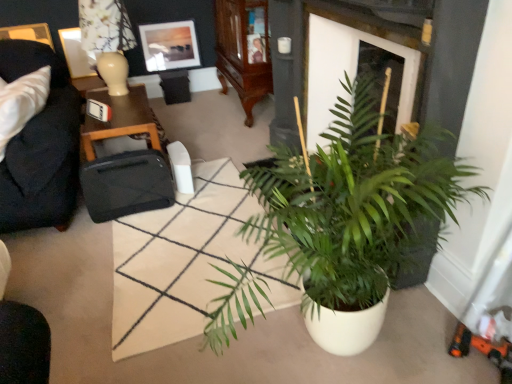
This screenshot has width=512, height=384. What do you see at coordinates (120, 119) in the screenshot?
I see `black leather suitcase at left` at bounding box center [120, 119].

The image size is (512, 384). What are the coordinates of `black matte suitcase at center` in the screenshot? It's located at (126, 184).

What is the approximate height of dark blue fabric couch at left?

The height of dark blue fabric couch at left is 71.08 centimeters.

Describe the element at coordinates (169, 45) in the screenshot. The height and width of the screenshot is (384, 512). I see `matte glass picture frame at upper center, marked as the first picture frame in a right-to-left arrangement` at that location.

This screenshot has height=384, width=512. In order to click on black leather suitcase at left in this screenshot , I will do `click(120, 119)`.

Based on the photo, from a real-world perspective, is dark blue fabric couch at left beneath black leather suitcase at left?

No, from a real-world perspective, dark blue fabric couch at left is not under black leather suitcase at left.

Considering the sizes of objects dark blue fabric couch at left and black leather suitcase at left in the image provided, who is bigger, dark blue fabric couch at left or black leather suitcase at left?

With larger size is dark blue fabric couch at left.

Between dark blue fabric couch at left and black leather suitcase at left, which one is positioned behind?

black leather suitcase at left is more distant.

Is dark blue fabric couch at left turned away from black leather suitcase at left?

No, dark blue fabric couch at left's orientation is not away from black leather suitcase at left.

Measure the distance from white glossy picture frame at upper left, the 1th picture frame in the left-to-right sequence, to wooden cabinet at upper center.

1.37 meters.

Would you consider white glossy picture frame at upper left, which ranks as the second picture frame in right-to-left order, to be distant from wooden cabinet at upper center?

Absolutely, white glossy picture frame at upper left, which ranks as the second picture frame in right-to-left order, is distant from wooden cabinet at upper center.

Does white glossy picture frame at upper left, the 1th picture frame in the left-to-right sequence, turn towards wooden cabinet at upper center?

No, white glossy picture frame at upper left, the 1th picture frame in the left-to-right sequence, is not facing towards wooden cabinet at upper center.

From the image's perspective, starting from the wooden cabinet at upper center, which picture frame is the 1st one above? Please provide its 2D coordinates.

[(76, 53)]

Which is correct: black leather suitcase at left is inside matte glass picture frame at upper center, marked as the first picture frame in a right-to-left arrangement, or outside of it?

black leather suitcase at left is not enclosed by matte glass picture frame at upper center, marked as the first picture frame in a right-to-left arrangement.

Can you confirm if black leather suitcase at left is thinner than matte glass picture frame at upper center, marked as the first picture frame in a right-to-left arrangement?

Incorrect, the width of black leather suitcase at left is not less than that of matte glass picture frame at upper center, marked as the first picture frame in a right-to-left arrangement.

From the image's perspective, which is above, black leather suitcase at left or matte glass picture frame at upper center, the second picture frame in the left-to-right sequence?

matte glass picture frame at upper center, the second picture frame in the left-to-right sequence.

This screenshot has height=384, width=512. Find the location of `desk lying in front of the matte glass picture frame at upper center, the second picture frame in the left-to-right sequence`. desk lying in front of the matte glass picture frame at upper center, the second picture frame in the left-to-right sequence is located at coordinates (120, 119).

Can you confirm if green leafy plant at center is taller than black matte suitcase at center?

No, green leafy plant at center is not taller than black matte suitcase at center.

Would you say green leafy plant at center is outside black matte suitcase at center?

green leafy plant at center is positioned outside black matte suitcase at center.

Considering their positions, is green leafy plant at center located in front of or behind black matte suitcase at center?

Clearly, green leafy plant at center is in front of black matte suitcase at center.

How much distance is there between green leafy plant at center and black matte suitcase at center?

14.10 inches.

Which object is wider, black matte suitcase at center or white ceramic lamp at upper left?

white ceramic lamp at upper left.

Could white ceramic lamp at upper left be considered to be inside black matte suitcase at center?

That's incorrect, white ceramic lamp at upper left is not inside black matte suitcase at center.

Looking at this image, considering the sizes of objects black matte suitcase at center and white ceramic lamp at upper left in the image provided, who is bigger, black matte suitcase at center or white ceramic lamp at upper left?

With larger size is white ceramic lamp at upper left.

Based on the photo, from a real-world perspective, which object rests below the other?

From a 3D spatial view, black matte suitcase at center is below.

Consider the image. From a real-world perspective, which is physically above, green matte plant at center or green leafy plant at center?

green matte plant at center, from a real-world perspective.

Can you tell me how much green matte plant at center and green leafy plant at center differ in facing direction?

green matte plant at center and green leafy plant at center are facing 2.18 degrees away from each other.

Identify the location of houseplant above the green leafy plant at center (from a real-world perspective). This screenshot has height=384, width=512. (352, 204).

Between green matte plant at center and green leafy plant at center, which one appears on the right side from the viewer's perspective?

From the viewer's perspective, green matte plant at center appears more on the right side.

Considering the sizes of matte glass picture frame at upper center, the second picture frame in the left-to-right sequence, and black leather suitcase at left in the image, is matte glass picture frame at upper center, the second picture frame in the left-to-right sequence, taller or shorter than black leather suitcase at left?

Clearly, matte glass picture frame at upper center, the second picture frame in the left-to-right sequence, is taller compared to black leather suitcase at left.

Considering the sizes of matte glass picture frame at upper center, the second picture frame in the left-to-right sequence, and black leather suitcase at left in the image, is matte glass picture frame at upper center, the second picture frame in the left-to-right sequence, bigger or smaller than black leather suitcase at left?

In the image, matte glass picture frame at upper center, the second picture frame in the left-to-right sequence, appears to be smaller than black leather suitcase at left.

From the image's perspective, would you say matte glass picture frame at upper center, marked as the first picture frame in a right-to-left arrangement, is positioned over black leather suitcase at left?

Yes, from the image's perspective, matte glass picture frame at upper center, marked as the first picture frame in a right-to-left arrangement, is above black leather suitcase at left.

Can you tell me how much matte glass picture frame at upper center, marked as the first picture frame in a right-to-left arrangement, and black leather suitcase at left differ in facing direction?

The angle between the facing direction of matte glass picture frame at upper center, marked as the first picture frame in a right-to-left arrangement, and the facing direction of black leather suitcase at left is 90.1 degrees.

Find the location of a particular element. desk beneath the dark blue fabric couch at left (from a real-world perspective) is located at coordinates (120, 119).

Locate an element on the screen. The width and height of the screenshot is (512, 384). the 1st picture frame behind the wooden cabinet at upper center is located at coordinates (76, 53).

Which object lies nearer to the anchor point green leafy plant at center, white glossy picture frame at upper left, the 1th picture frame in the left-to-right sequence, or wooden cabinet at upper center?

wooden cabinet at upper center is positioned closer to the anchor green leafy plant at center.

Looking at the image, which one is located closer to white ceramic lamp at upper left, black matte suitcase at center or dark blue fabric couch at left?

dark blue fabric couch at left is closer to white ceramic lamp at upper left.

Based on their spatial positions, is matte glass picture frame at upper center, marked as the first picture frame in a right-to-left arrangement, or wooden cabinet at upper center closer to white glossy picture frame at upper left, the 1th picture frame in the left-to-right sequence?

Based on the image, matte glass picture frame at upper center, marked as the first picture frame in a right-to-left arrangement, appears to be nearer to white glossy picture frame at upper left, the 1th picture frame in the left-to-right sequence.

Which object lies nearer to the anchor point green matte plant at center, dark blue fabric couch at left or black matte suitcase at center?

black matte suitcase at center is positioned closer to the anchor green matte plant at center.

Estimate the real-world distances between objects in this image. Which object is further from white glossy picture frame at upper left, which ranks as the second picture frame in right-to-left order, black leather suitcase at left or white ceramic lamp at upper left?

black leather suitcase at left.

When comparing their distances from black matte suitcase at center, does white ceramic lamp at upper left or matte glass picture frame at upper center, the second picture frame in the left-to-right sequence, seem further?

matte glass picture frame at upper center, the second picture frame in the left-to-right sequence, is positioned further to the anchor black matte suitcase at center.

Which object lies further to the anchor point black leather suitcase at left, green leafy plant at center or wooden cabinet at upper center?

wooden cabinet at upper center.

Estimate the real-world distances between objects in this image. Which object is further from white ceramic lamp at upper left, black leather suitcase at left or dark blue fabric couch at left?

Among the two, dark blue fabric couch at left is located further to white ceramic lamp at upper left.

Locate an element on the screen. This screenshot has width=512, height=384. luggage and bags between white ceramic lamp at upper left and green leafy plant at center in the vertical direction is located at coordinates [x=126, y=184].

Image resolution: width=512 pixels, height=384 pixels. I want to click on cabinetry positioned between dark blue fabric couch at left and matte glass picture frame at upper center, the second picture frame in the left-to-right sequence, from near to far, so pos(244,50).

Where is `luggage and bags located between dark blue fabric couch at left and matte glass picture frame at upper center, marked as the first picture frame in a right-to-left arrangement, in the depth direction`? The width and height of the screenshot is (512, 384). luggage and bags located between dark blue fabric couch at left and matte glass picture frame at upper center, marked as the first picture frame in a right-to-left arrangement, in the depth direction is located at coordinates (126, 184).

Identify the location of studio couch that lies between white ceramic lamp at upper left and black matte suitcase at center from top to bottom. (41, 146).